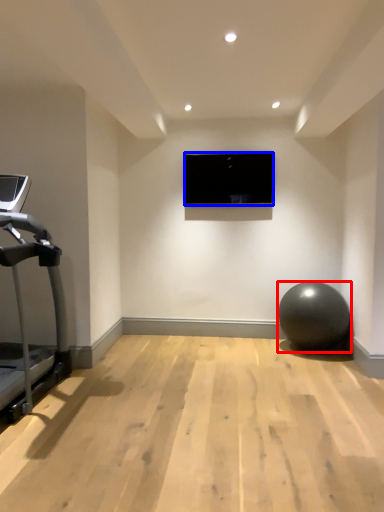
Question: Which of the following is the closest to the observer, ball (highlighted by a red box) or computer screen (highlighted by a blue box)?

Choices:
 (A) ball
 (B) computer screen

Answer: (A)